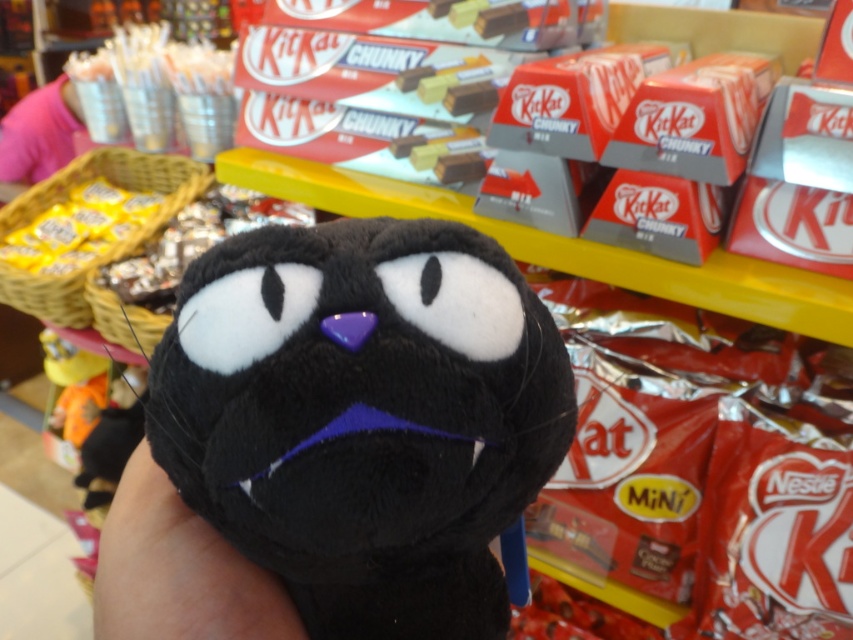
Question: Which object appears farthest from the camera in this image?

Choices:
 (A) soft plush toy at center
 (B) pink fabric shirt at upper left
 (C) soft skin at center

Answer: (B)

Question: Can you confirm if soft plush toy at center is positioned below pink fabric shirt at upper left?

Choices:
 (A) yes
 (B) no

Answer: (A)

Question: Which of the following is the farthest from the observer?

Choices:
 (A) soft plush toy at center
 (B) pink fabric shirt at upper left

Answer: (B)

Question: Is soft skin at center thinner than pink fabric shirt at upper left?

Choices:
 (A) no
 (B) yes

Answer: (B)

Question: Estimate the real-world distances between objects in this image. Which object is closer to the soft plush toy at center?

Choices:
 (A) pink fabric shirt at upper left
 (B) soft skin at center

Answer: (B)

Question: In this image, where is soft plush toy at center located relative to soft skin at center?

Choices:
 (A) below
 (B) above

Answer: (B)